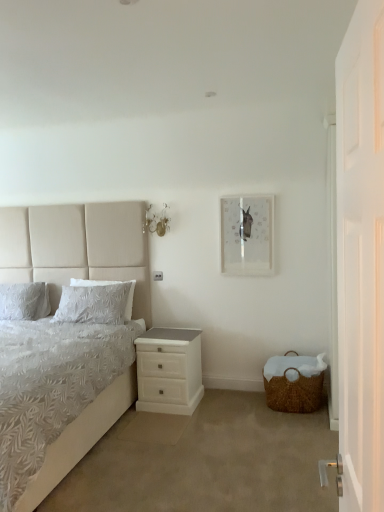
This screenshot has width=384, height=512. I want to click on free space to the right of white glossy nightstand at lower center, so click(x=216, y=402).